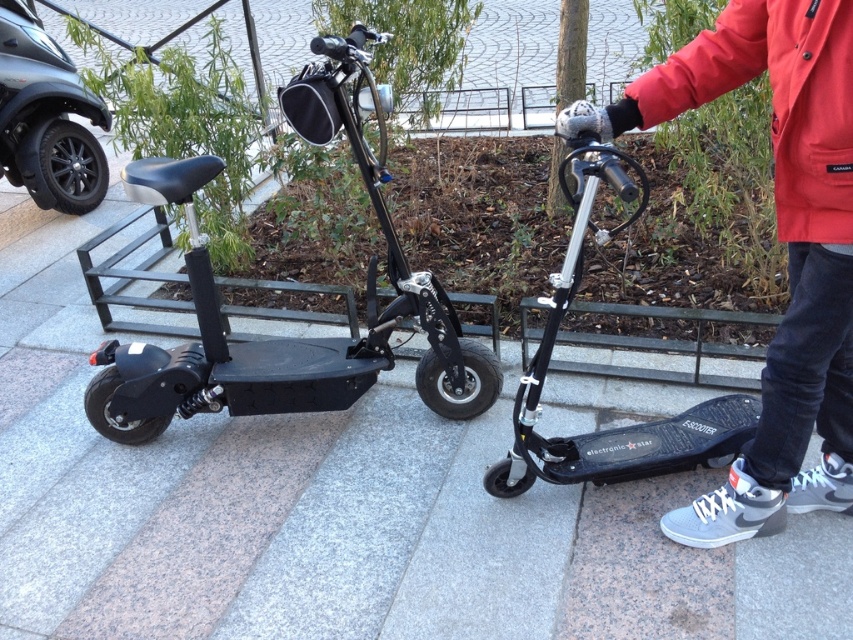
How much distance is there between gray fabric jacket at upper right and red waterproof jacket at upper right?

gray fabric jacket at upper right is 4.66 inches away from red waterproof jacket at upper right.

Is point (802, 429) closer to viewer compared to point (780, 113)?

No.

The height and width of the screenshot is (640, 853). In order to click on gray fabric jacket at upper right in this screenshot , I will do `click(780, 241)`.

Is gray fabric jacket at upper right closer to camera compared to black matte scooter at left?

Yes, gray fabric jacket at upper right is in front of black matte scooter at left.

Can you confirm if gray fabric jacket at upper right is positioned below black matte scooter at left?

No.

Does point (820, 148) come behind point (119, 388)?

No, it is in front of (119, 388).

The image size is (853, 640). In order to click on gray fabric jacket at upper right in this screenshot , I will do `click(780, 241)`.

Does black matte scooter at left have a lesser width compared to red waterproof jacket at upper right?

Incorrect, black matte scooter at left's width is not less than red waterproof jacket at upper right's.

Is black matte scooter at left shorter than red waterproof jacket at upper right?

No.

What do you see at coordinates (288, 337) in the screenshot?
I see `black matte scooter at left` at bounding box center [288, 337].

Locate an element on the screen. The height and width of the screenshot is (640, 853). black matte scooter at left is located at coordinates (288, 337).